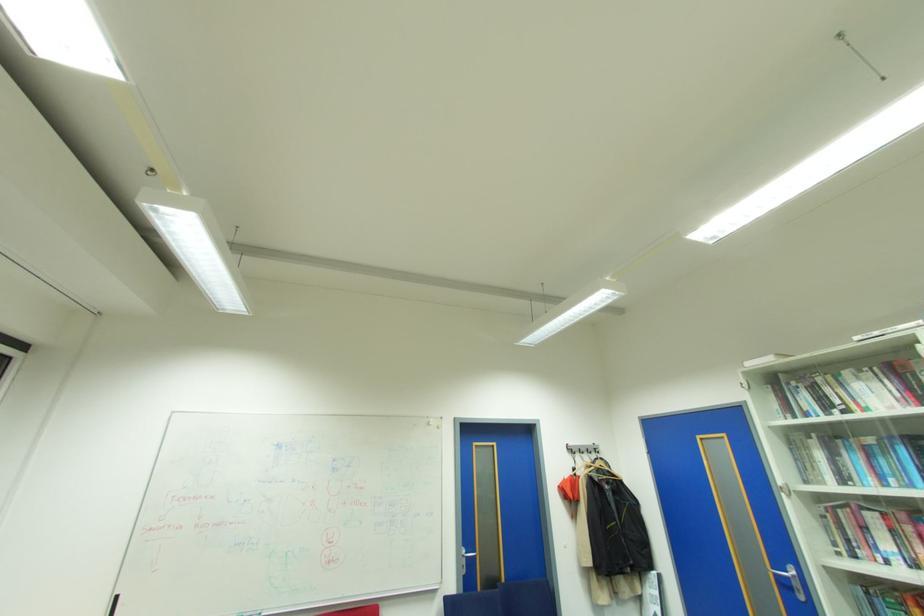
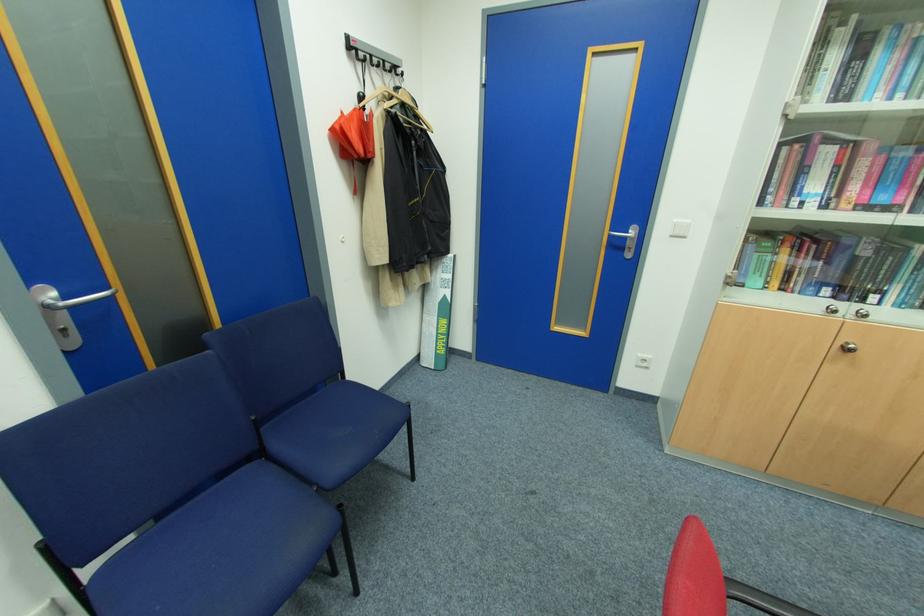
The point at (573, 453) is marked in the first image. Where is the corresponding point in the second image?

(353, 55)